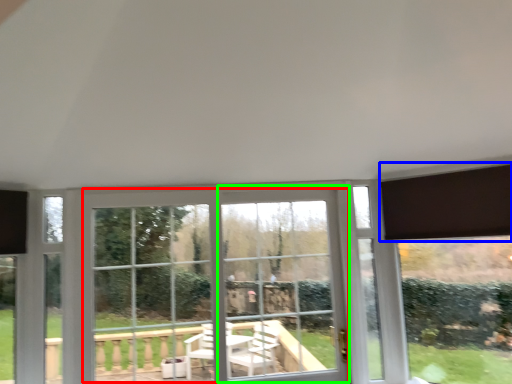
Question: Which object is positioned closest to bay window (highlighted by a red box)? Select from curtain (highlighted by a blue box) and window frame (highlighted by a green box).

Choices:
 (A) curtain
 (B) window frame

Answer: (B)